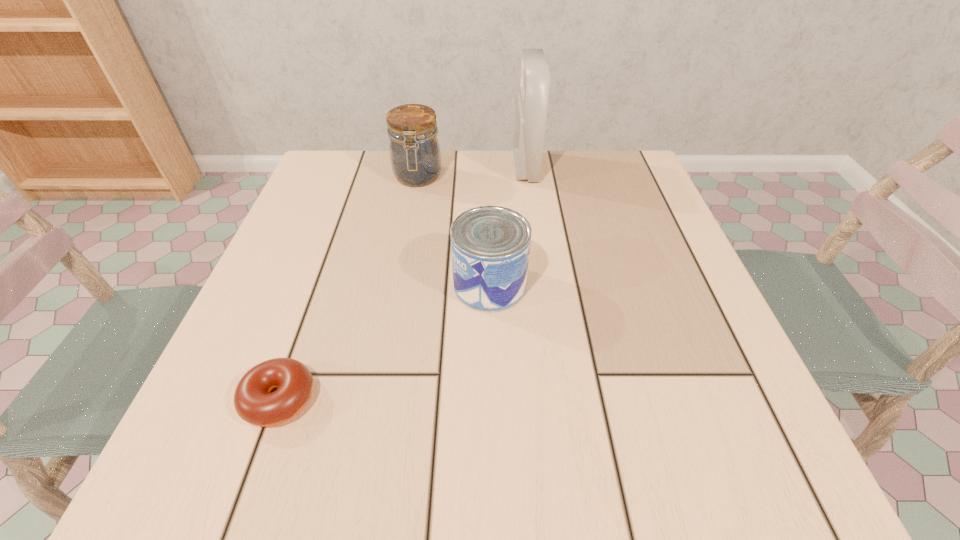
Find the location of a particular element. The image size is (960, 540). vacant area that lies between the doughnut and the first-aid kit is located at coordinates (402, 283).

Where is `vacant space that is in between the leftmost object and the third tallest object`? Image resolution: width=960 pixels, height=540 pixels. vacant space that is in between the leftmost object and the third tallest object is located at coordinates pos(384,342).

Identify the location of vacant space that is in between the shortest object and the second object from left to right. (348, 288).

Point out which object is positioned as the third nearest to the leftmost object. Please provide its 2D coordinates. Your answer should be formatted as a tuple, i.e. [(x, y)], where the tuple contains the x and y coordinates of a point satisfying the conditions above.

[(531, 102)]

Locate an element on the screen. object that stands as the closest to the third object from right to left is located at coordinates (531, 102).

Where is `free spot that satisfies the following two spatial constraints: 1. on the front-facing side of the first-aid kit; 2. on the lid of the third object from right to left`? Image resolution: width=960 pixels, height=540 pixels. free spot that satisfies the following two spatial constraints: 1. on the front-facing side of the first-aid kit; 2. on the lid of the third object from right to left is located at coordinates (527, 178).